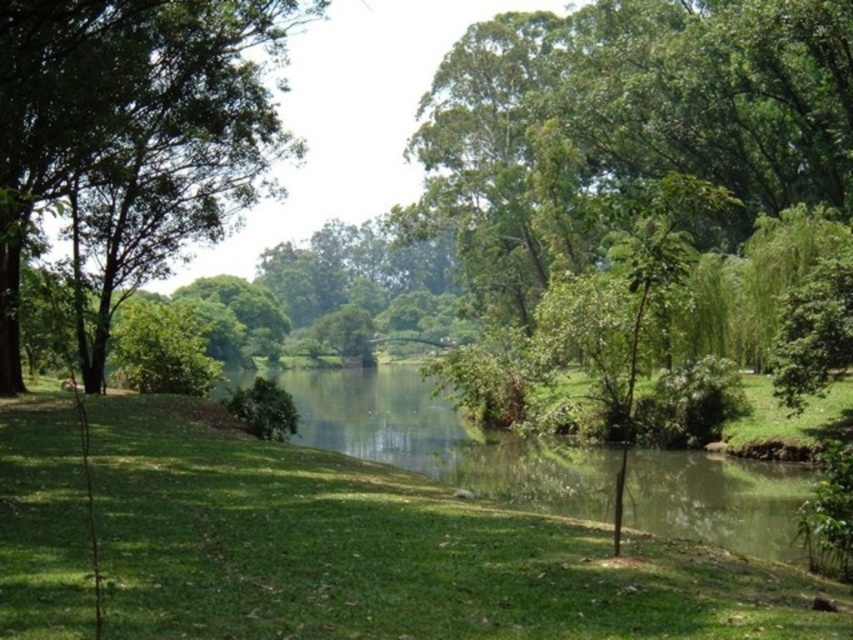
Which is above, green grassy at center or green leafy tree at left?

green leafy tree at left

Between point (166, 556) and point (70, 36), which one is positioned behind?

Positioned behind is point (70, 36).

Locate an element on the screen. green grassy at center is located at coordinates (386, 552).